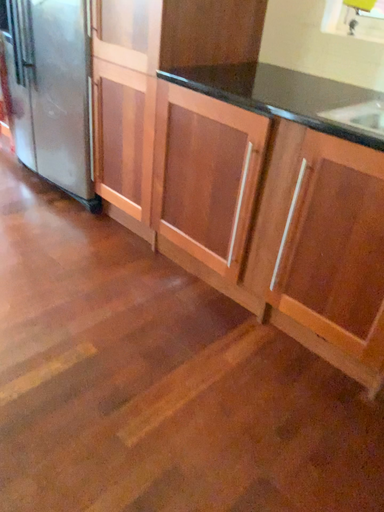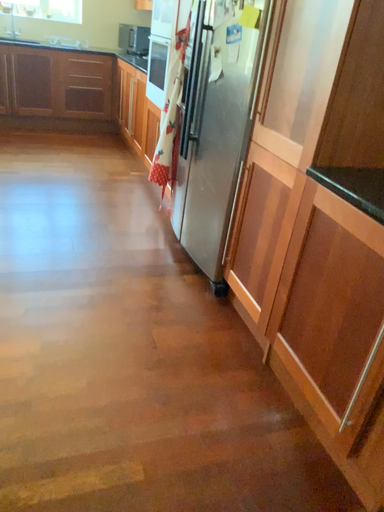
Question: How did the camera likely rotate when shooting the video?

Choices:
 (A) rotated right
 (B) rotated left

Answer: (B)